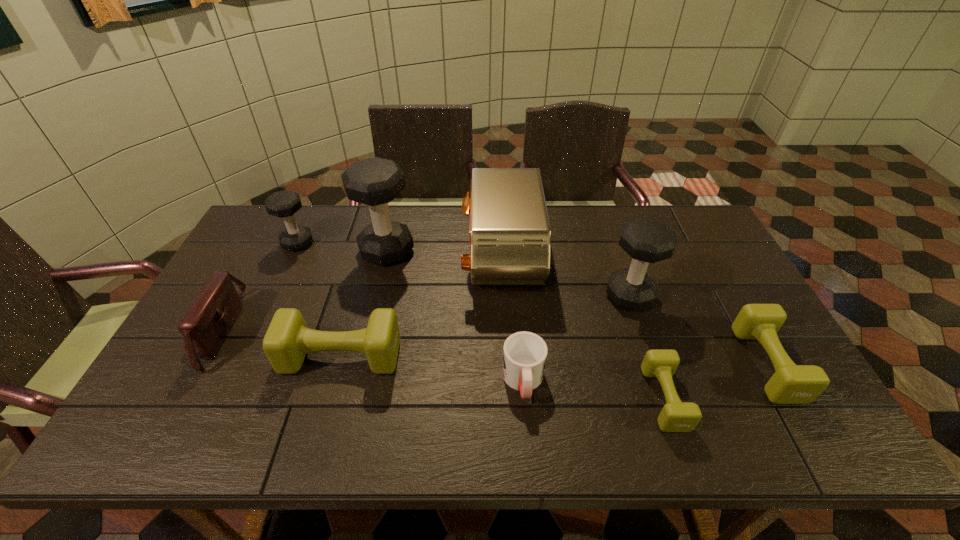
At what (x,y) coordinates should I click in order to perform the action: click on mug. Please return your answer as a coordinate pair (x, y). Looking at the image, I should click on (524, 354).

Identify the location of the rightmost object. This screenshot has height=540, width=960. (790, 384).

You are a GUI agent. You are given a task and a screenshot of the screen. Output one action in this format:
    pyautogui.click(x=<x>, y=<y>)
    Task: Click on the second smallest olive dumbbell
    The image size is (960, 540).
    Given the screenshot: What is the action you would take?
    pyautogui.click(x=790, y=384)

Where is `the shortest dumbbell`? This screenshot has width=960, height=540. the shortest dumbbell is located at coordinates (676, 416).

The height and width of the screenshot is (540, 960). I want to click on the smallest olive dumbbell, so 676,416.

You are a GUI agent. You are given a task and a screenshot of the screen. Output one action in this format:
    pyautogui.click(x=<x>, y=<y>)
    Task: Click on the vacant space situated 0.280m on the front of the tallest object
    This screenshot has height=540, width=960.
    Given the screenshot: What is the action you would take?
    pyautogui.click(x=366, y=340)

At what (x,y) coordinates should I click in order to perform the action: click on free space located on the front of the rightmost gray dumbbell. Please return your answer as a coordinate pair (x, y). The image size is (960, 540). Looking at the image, I should click on (642, 334).

In order to click on vacant space positioned on the door side of the white toaster oven in this screenshot , I will do `click(385, 259)`.

Identify the location of free space located on the door side of the white toaster oven. pyautogui.click(x=417, y=259).

At what (x,y) coordinates should I click in order to perform the action: click on vacant space situated on the door side of the white toaster oven. Please return your answer as a coordinate pair (x, y). Looking at the image, I should click on (361, 259).